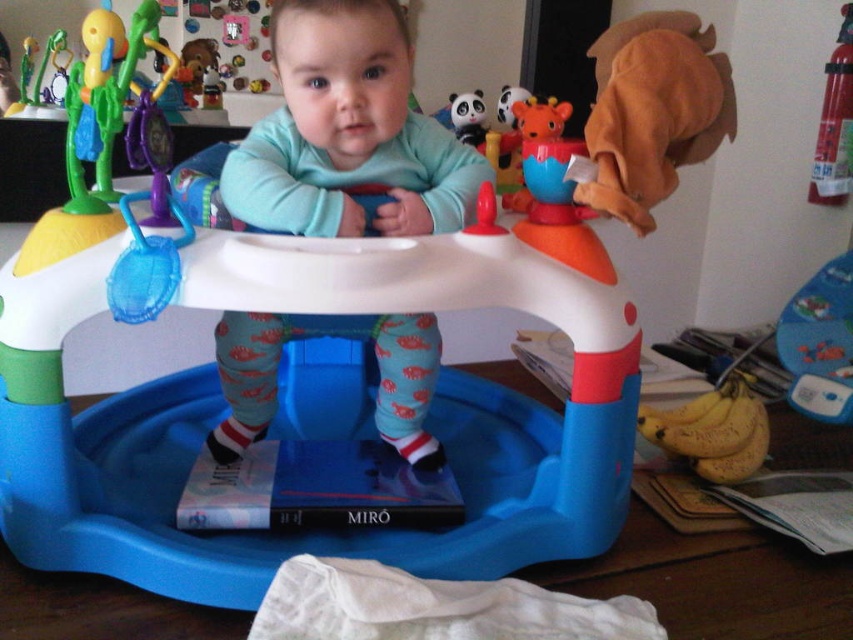
You are a parent trying to choose between the blue plastic walker at center and the blue soft walker at center for your baby. Based on their height, which one would be more suitable for a baby who needs a taller walker?

The blue plastic walker at center is much taller than the blue soft walker at center, so it would be more suitable for a baby who needs a taller walker.

You are a parent trying to choose between the blue plastic walker at center and the blue soft walker at center for your baby. Which one has a greater width?

The blue plastic walker at center might be wider than blue soft walker at center according to the description.